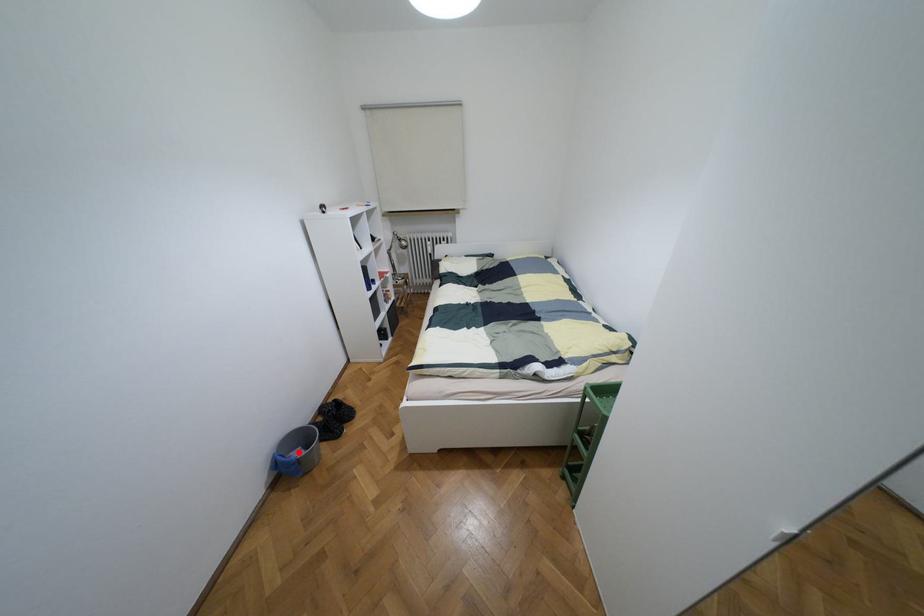
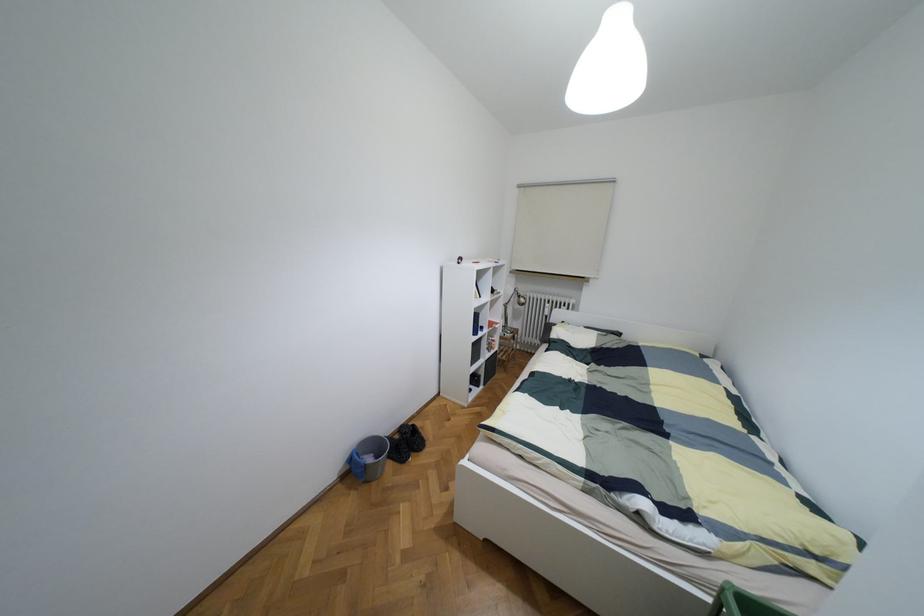
Locate, in the second image, the point that corresponds to the highlighted location in the first image.

(369, 459)